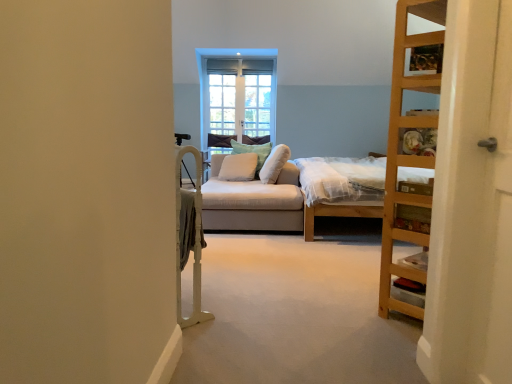
Question: Can wooden ladder at right be found inside white wood screen door at right?

Choices:
 (A) yes
 (B) no

Answer: (B)

Question: Is white wood screen door at right shorter than wooden ladder at right?

Choices:
 (A) no
 (B) yes

Answer: (B)

Question: Considering the relative sizes of white wood screen door at right and wooden ladder at right in the image provided, is white wood screen door at right thinner than wooden ladder at right?

Choices:
 (A) yes
 (B) no

Answer: (A)

Question: Is white wood screen door at right with wooden ladder at right?

Choices:
 (A) no
 (B) yes

Answer: (A)

Question: Are white wood screen door at right and wooden ladder at right far apart?

Choices:
 (A) yes
 (B) no

Answer: (B)

Question: Is white wood screen door at right situated inside wooden ladder at right or outside?

Choices:
 (A) outside
 (B) inside

Answer: (A)

Question: From the image's perspective, relative to wooden ladder at right, is white wood screen door at right above or below?

Choices:
 (A) above
 (B) below

Answer: (B)

Question: In the image, is white wood screen door at right positioned in front of or behind wooden ladder at right?

Choices:
 (A) front
 (B) behind

Answer: (A)

Question: Is point (509, 226) positioned closer to the camera than point (386, 251)?

Choices:
 (A) farther
 (B) closer

Answer: (B)

Question: Do you think white soft pillow at center, which is the 3th pillow from left to right, is within white soft cushion at center, marked as the 1th pillow in a left-to-right arrangement, or outside of it?

Choices:
 (A) inside
 (B) outside

Answer: (B)

Question: In terms of size, does white soft pillow at center, which is the first pillow from right to left, appear bigger or smaller than white soft cushion at center, marked as the 1th pillow in a left-to-right arrangement?

Choices:
 (A) big
 (B) small

Answer: (A)

Question: Is white soft pillow at center, which is the 3th pillow from left to right, in front of or behind white soft cushion at center, marked as the 1th pillow in a left-to-right arrangement, in the image?

Choices:
 (A) behind
 (B) front

Answer: (B)

Question: Is white soft pillow at center, which is the 3th pillow from left to right, wider or thinner than white soft cushion at center, marked as the 1th pillow in a left-to-right arrangement?

Choices:
 (A) thin
 (B) wide

Answer: (A)

Question: From the image's perspective, is white soft cushion at center, arranged as the third pillow when viewed from the right, above or below clear glass window at center?

Choices:
 (A) below
 (B) above

Answer: (A)

Question: Considering the positions of point (240, 153) and point (223, 84), is point (240, 153) closer or farther from the camera than point (223, 84)?

Choices:
 (A) closer
 (B) farther

Answer: (A)